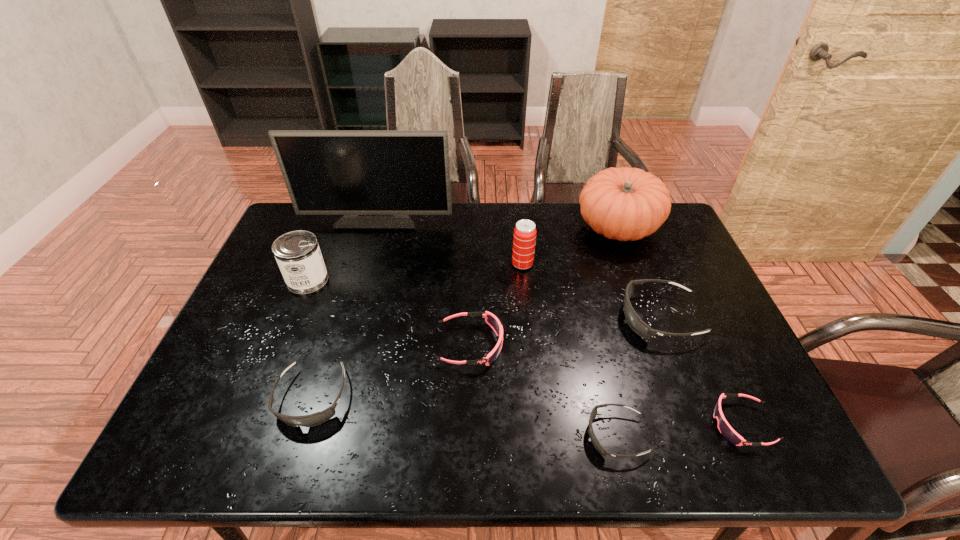
At what (x,y) coordinates should I click in order to perform the action: click on black monitor. Please return your answer as a coordinate pair (x, y). This screenshot has width=960, height=540. Looking at the image, I should click on (376, 178).

You are a GUI agent. You are given a task and a screenshot of the screen. Output one action in this format:
    pyautogui.click(x=<x>, y=<y>)
    Task: Click on the tallest object
    
    Given the screenshot: What is the action you would take?
    pyautogui.click(x=376, y=178)

At what (x,y) coordinates should I click in order to perform the action: click on pumpkin. Please return your answer as a coordinate pair (x, y). Looking at the image, I should click on (626, 204).

At what (x,y) coordinates should I click in order to perform the action: click on orange pumpkin. Please return your answer as a coordinate pair (x, y). This screenshot has width=960, height=540. Looking at the image, I should click on (626, 204).

Locate an element on the screen. This screenshot has height=540, width=960. the fifth object from right to left is located at coordinates (524, 238).

Locate an element on the screen. This screenshot has width=960, height=540. can is located at coordinates (298, 255).

I want to click on the fifth tallest object, so click(635, 322).

This screenshot has height=540, width=960. What are the coordinates of `the rightmost black goggles` in the screenshot? It's located at (635, 322).

Where is `the left pink goggles`? This screenshot has height=540, width=960. the left pink goggles is located at coordinates (491, 320).

Find the location of `the bigger pink goggles`. the bigger pink goggles is located at coordinates (491, 320).